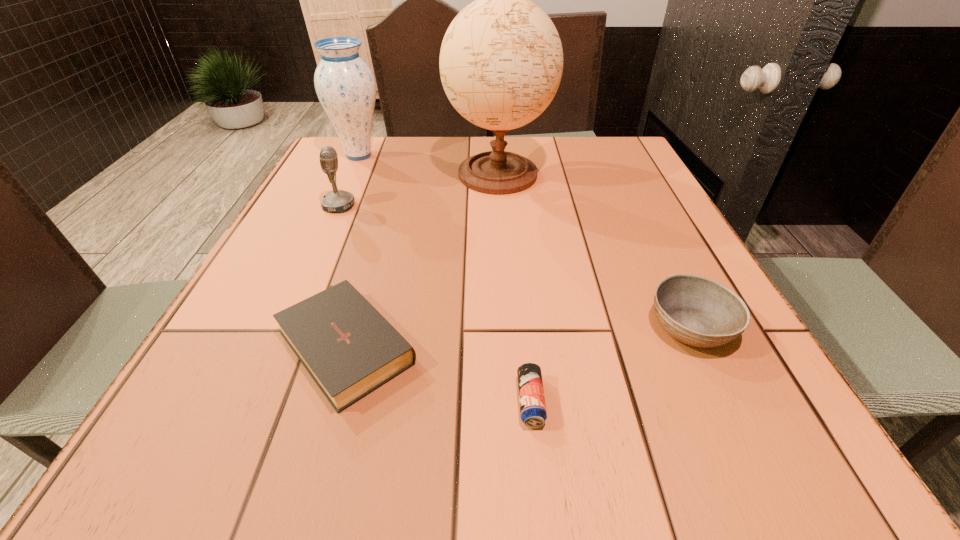
The height and width of the screenshot is (540, 960). I want to click on free space that satisfies the following two spatial constraints: 1. on the back side of the fourth tallest object; 2. on the left side of the Bible, so click(352, 327).

Identify the location of vacant space that satisfies the following two spatial constraints: 1. on the front-facing side of the Bible; 2. on the right side of the microphone. (277, 341).

This screenshot has width=960, height=540. In order to click on vacant area that satisfies the following two spatial constraints: 1. on the surface of the tallest object; 2. on the front-facing side of the third tallest object in this screenshot , I will do `click(499, 206)`.

This screenshot has width=960, height=540. Find the location of `free space that satisfies the following two spatial constraints: 1. on the surface of the tallest object; 2. on the left side of the beer can`. free space that satisfies the following two spatial constraints: 1. on the surface of the tallest object; 2. on the left side of the beer can is located at coordinates (512, 401).

The image size is (960, 540). Identify the location of vacant position in the image that satisfies the following two spatial constraints: 1. on the surface of the tallest object; 2. on the front-facing side of the fourth shortest object. (499, 206).

Locate an element on the screen. Image resolution: width=960 pixels, height=540 pixels. vacant space that satisfies the following two spatial constraints: 1. on the surface of the globe; 2. on the front-facing side of the third tallest object is located at coordinates (499, 206).